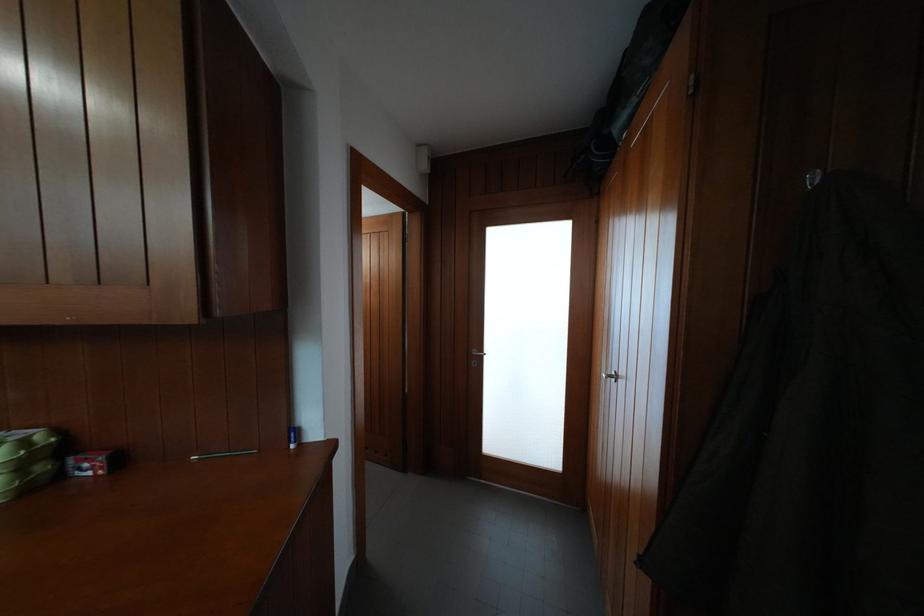
Find the location of a particular element. The image size is (924, 616). small red box is located at coordinates (90, 464).